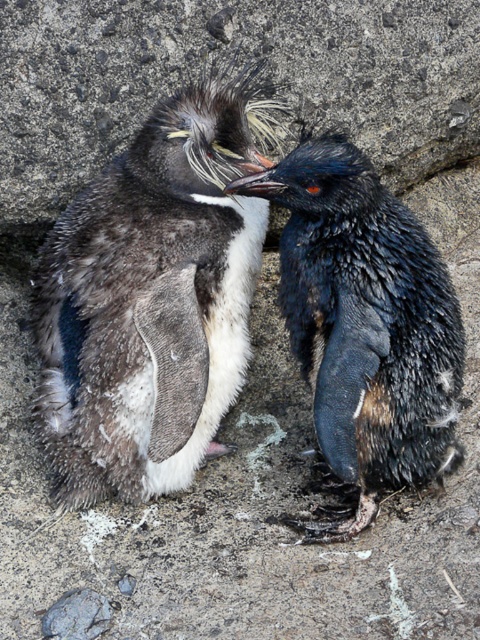
Question: Which of the following is the closest to the observer?

Choices:
 (A) (457, 388)
 (B) (123, 280)

Answer: (B)

Question: Observing the image, what is the correct spatial positioning of dark brown fluffy penguin at center in reference to shiny black penguin at right?

Choices:
 (A) right
 (B) left

Answer: (B)

Question: Is the position of dark brown fluffy penguin at center less distant than that of shiny black penguin at right?

Choices:
 (A) no
 (B) yes

Answer: (A)

Question: Can you confirm if dark brown fluffy penguin at center is bigger than shiny black penguin at right?

Choices:
 (A) no
 (B) yes

Answer: (B)

Question: Among these points, which one is farthest from the camera?

Choices:
 (A) (137, 250)
 (B) (266, 180)

Answer: (A)

Question: Which point is farther to the camera?

Choices:
 (A) dark brown fluffy penguin at center
 (B) shiny black penguin at right

Answer: (A)